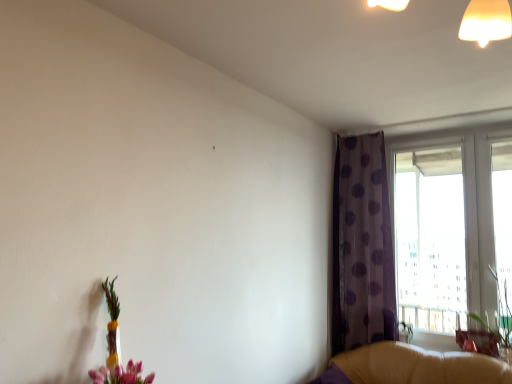
What do you see at coordinates (362, 246) in the screenshot? I see `purple dotted fabric at upper right` at bounding box center [362, 246].

Where is `matte brown swivel chair at lower right`? This screenshot has width=512, height=384. matte brown swivel chair at lower right is located at coordinates (480, 338).

In order to face leather couch at lower right, should I rotate leftwards or rightwards?

Rotate your view right by about 19.263°.

In order to click on leather couch at lower right in this screenshot , I will do coord(413,366).

The image size is (512, 384). What do you see at coordinates (117, 349) in the screenshot? I see `translucent glass vase at lower left` at bounding box center [117, 349].

Where is `green leafy plant at right`? Image resolution: width=512 pixels, height=384 pixels. green leafy plant at right is located at coordinates (498, 316).

Is green leafy plant at right to the left of transparent glass window at right from the viewer's perspective?

In fact, green leafy plant at right is to the right of transparent glass window at right.

Is green leafy plant at right far from transparent glass window at right?

No, green leafy plant at right is not far from transparent glass window at right.

Which is behind, green leafy plant at right or transparent glass window at right?

transparent glass window at right is behind.

In terms of height, does green leafy plant at right look taller or shorter compared to transparent glass window at right?

green leafy plant at right is shorter than transparent glass window at right.

Between green leafy plant at right and leather couch at lower right, which one has less height?

leather couch at lower right.

Locate an element on the screen. The height and width of the screenshot is (384, 512). plant on the right of leather couch at lower right is located at coordinates (498, 316).

Is there a large distance between green leafy plant at right and leather couch at lower right?

green leafy plant at right is actually quite close to leather couch at lower right.

From the image's perspective, which object appears higher, green leafy plant at right or leather couch at lower right?

From the image's view, green leafy plant at right is above.

Can we say transparent glass window at right lies outside purple dotted fabric at upper right?

transparent glass window at right lies outside purple dotted fabric at upper right's area.

Looking at their sizes, would you say transparent glass window at right is wider or thinner than purple dotted fabric at upper right?

transparent glass window at right is thinner than purple dotted fabric at upper right.

Between transparent glass window at right and purple dotted fabric at upper right, which one has less height?

transparent glass window at right is shorter.

How far apart are transparent glass window at right and purple dotted fabric at upper right?

The distance of transparent glass window at right from purple dotted fabric at upper right is 28.15 inches.

From the image's perspective, is purple dotted fabric at upper right above or below leather couch at lower right?

From the image's perspective, purple dotted fabric at upper right appears above leather couch at lower right.

Is purple dotted fabric at upper right not close to leather couch at lower right?

Actually, purple dotted fabric at upper right and leather couch at lower right are a little close together.

Is purple dotted fabric at upper right wider than leather couch at lower right?

No.

Could you tell me if purple dotted fabric at upper right is turned towards leather couch at lower right?

No, purple dotted fabric at upper right does not turn towards leather couch at lower right.

Is purple dotted fabric at upper right spatially inside matte brown swivel chair at lower right, or outside of it?

purple dotted fabric at upper right is not enclosed by matte brown swivel chair at lower right.

Considering the relative positions of purple dotted fabric at upper right and matte brown swivel chair at lower right in the image provided, is purple dotted fabric at upper right to the right of matte brown swivel chair at lower right from the viewer's perspective?

In fact, purple dotted fabric at upper right is to the left of matte brown swivel chair at lower right.

From a real-world perspective, is purple dotted fabric at upper right positioned above or below matte brown swivel chair at lower right?

From a real-world perspective, purple dotted fabric at upper right is physically above matte brown swivel chair at lower right.

How different are the orientations of green leafy plant at right and matte brown swivel chair at lower right in degrees?

The facing directions of green leafy plant at right and matte brown swivel chair at lower right are 0.963 degrees apart.

Would you say green leafy plant at right is inside or outside matte brown swivel chair at lower right?

green leafy plant at right exists outside the volume of matte brown swivel chair at lower right.

From a real-world perspective, is green leafy plant at right below matte brown swivel chair at lower right?

No, from a real-world perspective, green leafy plant at right is not under matte brown swivel chair at lower right.

From the image's perspective, which one is positioned lower, green leafy plant at right or matte brown swivel chair at lower right?

matte brown swivel chair at lower right.

Is translucent glass vase at lower left taller than purple dotted fabric at upper right?

In fact, translucent glass vase at lower left may be shorter than purple dotted fabric at upper right.

Is translucent glass vase at lower left placed right next to purple dotted fabric at upper right?

There is a gap between translucent glass vase at lower left and purple dotted fabric at upper right.

Choose the correct answer: Is translucent glass vase at lower left inside purple dotted fabric at upper right or outside it?

translucent glass vase at lower left cannot be found inside purple dotted fabric at upper right.

From the image's perspective, which is above, translucent glass vase at lower left or purple dotted fabric at upper right?

purple dotted fabric at upper right, from the image's perspective.

Identify the location of plant below the transparent glass window at right (from a real-world perspective). The height and width of the screenshot is (384, 512). (x=498, y=316).

The image size is (512, 384). Find the location of `plant behind the leather couch at lower right`. plant behind the leather couch at lower right is located at coordinates (498, 316).

Looking at the image, which one is located further to translucent glass vase at lower left, green leafy plant at right or purple dotted fabric at upper right?

Based on the image, green leafy plant at right appears to be further to translucent glass vase at lower left.

Based on their spatial positions, is transparent glass window at right or purple dotted fabric at upper right closer to matte brown swivel chair at lower right?

transparent glass window at right is positioned closer to the anchor matte brown swivel chair at lower right.

Based on their spatial positions, is transparent glass window at right or green leafy plant at right further from translucent glass vase at lower left?

The object further to translucent glass vase at lower left is transparent glass window at right.

Which object lies nearer to the anchor point translucent glass vase at lower left, leather couch at lower right or purple dotted fabric at upper right?

leather couch at lower right is closer to translucent glass vase at lower left.

Consider the image. Looking at the image, which one is located closer to translucent glass vase at lower left, leather couch at lower right or transparent glass window at right?

leather couch at lower right is closer to translucent glass vase at lower left.

Which object lies further to the anchor point matte brown swivel chair at lower right, green leafy plant at right or translucent glass vase at lower left?

translucent glass vase at lower left is further to matte brown swivel chair at lower right.

From the image, which object appears to be farther from green leafy plant at right, leather couch at lower right or transparent glass window at right?

transparent glass window at right lies further to green leafy plant at right than the other object.

Based on their spatial positions, is transparent glass window at right or matte brown swivel chair at lower right further from leather couch at lower right?

transparent glass window at right.

Find the location of a particular element. window situated between translucent glass vase at lower left and green leafy plant at right from left to right is located at coordinates (451, 227).

Identify the location of window positioned between leather couch at lower right and matte brown swivel chair at lower right from near to far. Image resolution: width=512 pixels, height=384 pixels. (451, 227).

You are a GUI agent. You are given a task and a screenshot of the screen. Output one action in this format:
    pyautogui.click(x=<x>, y=<y>)
    Task: Click on the window between translucent glass vase at lower left and matte brown swivel chair at lower right from left to right
    
    Given the screenshot: What is the action you would take?
    pyautogui.click(x=451, y=227)

Locate an element on the screen. This screenshot has height=384, width=512. curtain between translucent glass vase at lower left and green leafy plant at right in the horizontal direction is located at coordinates (362, 246).